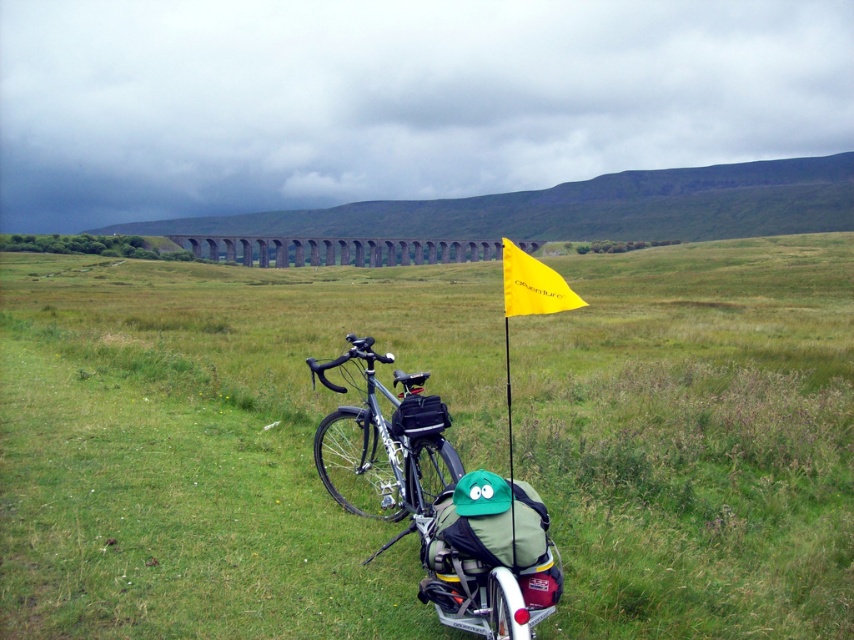
Measure the distance between silver metallic bicycle at center and gray concrete viaduct at center.

silver metallic bicycle at center and gray concrete viaduct at center are 42.19 meters apart from each other.

Which is above, silver metallic bicycle at center or gray concrete viaduct at center?

Positioned higher is gray concrete viaduct at center.

This screenshot has width=854, height=640. Describe the element at coordinates (439, 504) in the screenshot. I see `silver metallic bicycle at center` at that location.

Locate an element on the screen. The image size is (854, 640). silver metallic bicycle at center is located at coordinates (439, 504).

Can you confirm if green grassy field at center is shorter than gray concrete viaduct at center?

Indeed, green grassy field at center has a lesser height compared to gray concrete viaduct at center.

In the scene shown: Who is lower down, green grassy field at center or gray concrete viaduct at center?

green grassy field at center is lower down.

Is point (150, 586) behind point (418, 243)?

No.

The width and height of the screenshot is (854, 640). In order to click on green grassy field at center in this screenshot , I will do `click(215, 442)`.

Is point (320, 244) behind point (553, 282)?

That is True.

Who is positioned more to the right, gray concrete viaduct at center or yellow fabric flag at center?

Positioned to the right is yellow fabric flag at center.

Identify the location of gray concrete viaduct at center. This screenshot has width=854, height=640. (338, 250).